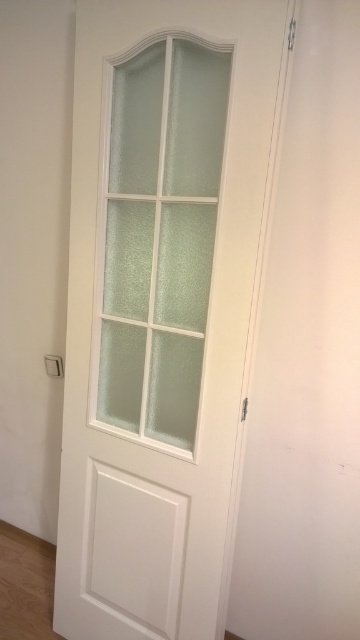
Question: Does white matte door at center appear over frosted glass door at center?

Choices:
 (A) no
 (B) yes

Answer: (A)

Question: Is white matte door at center positioned before frosted glass door at center?

Choices:
 (A) no
 (B) yes

Answer: (B)

Question: Is white matte door at center to the left of frosted glass door at center from the viewer's perspective?

Choices:
 (A) yes
 (B) no

Answer: (A)

Question: Among these objects, which one is farthest from the camera?

Choices:
 (A) frosted glass door at center
 (B) white matte door at center

Answer: (A)